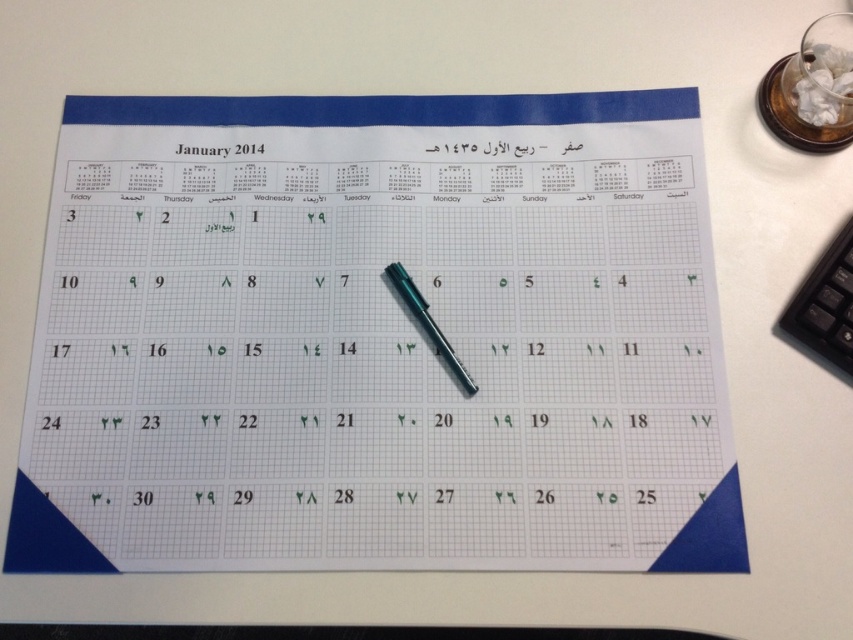
Is black plastic calculator at right positioned in front of green paper at center?

No, it is not.

Between black plastic calculator at right and green paper at center, which one has more height?

Standing taller between the two is black plastic calculator at right.

Is point (840, 259) positioned in front of point (251, 500)?

No, it is not.

Image resolution: width=853 pixels, height=640 pixels. I want to click on black plastic calculator at right, so click(825, 305).

Based on the photo, measure the distance between teal metallic pen at center and green paper at center.

teal metallic pen at center is 6.11 inches from green paper at center.

Does teal metallic pen at center have a lesser width compared to green paper at center?

No.

The image size is (853, 640). Describe the element at coordinates (427, 323) in the screenshot. I see `teal metallic pen at center` at that location.

You are a GUI agent. You are given a task and a screenshot of the screen. Output one action in this format:
    pyautogui.click(x=<x>, y=<y>)
    Task: Click on the teal metallic pen at center
    This screenshot has height=640, width=853.
    Given the screenshot: What is the action you would take?
    pyautogui.click(x=427, y=323)

Can you confirm if black plastic calculator at right is positioned above teal metallic pen at center?

Yes, black plastic calculator at right is above teal metallic pen at center.

Between black plastic calculator at right and teal metallic pen at center, which one appears on the right side from the viewer's perspective?

From the viewer's perspective, black plastic calculator at right appears more on the right side.

Describe the element at coordinates (825, 305) in the screenshot. This screenshot has width=853, height=640. I see `black plastic calculator at right` at that location.

The image size is (853, 640). I want to click on black plastic calculator at right, so click(x=825, y=305).